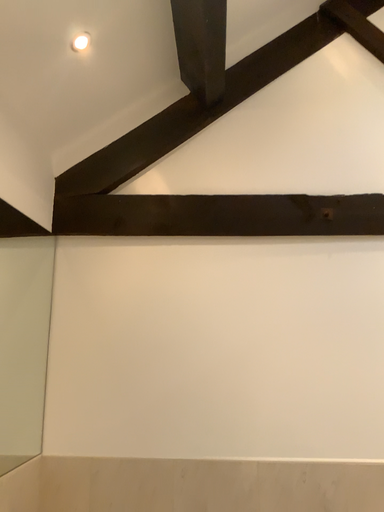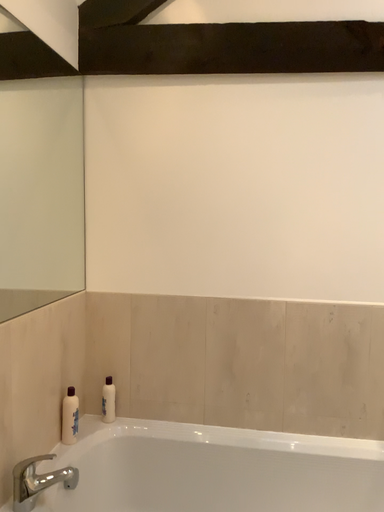
Question: Which way did the camera rotate in the video?

Choices:
 (A) rotated upward
 (B) rotated downward

Answer: (B)